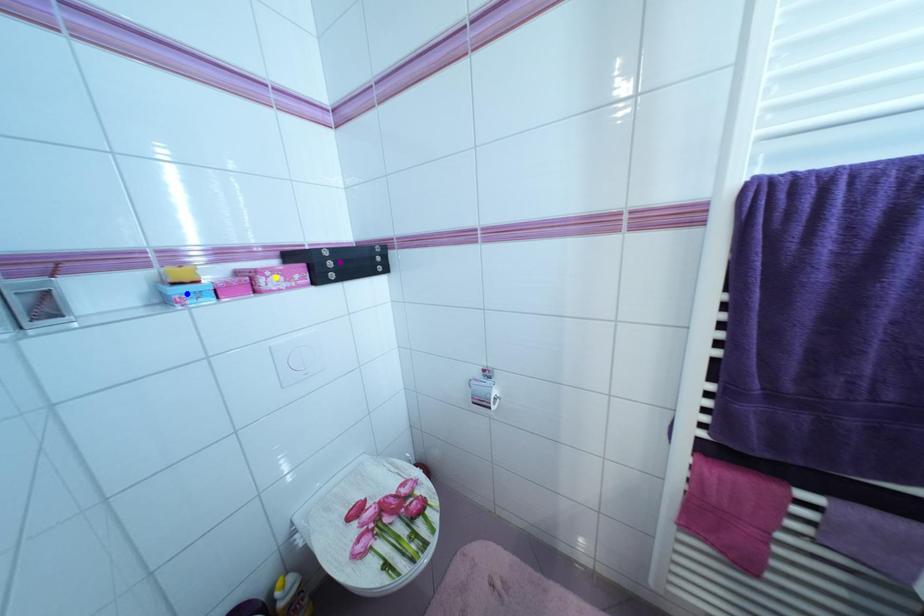
Order these from nearest to farthest:
- yellow point
- purple point
- blue point

1. purple point
2. yellow point
3. blue point